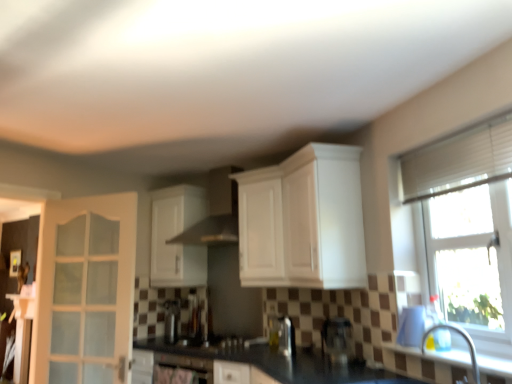
What do you see at coordinates (259, 360) in the screenshot? The height and width of the screenshot is (384, 512). I see `black granite countertop at center` at bounding box center [259, 360].

Where is `transparent glass window at right`? This screenshot has height=384, width=512. transparent glass window at right is located at coordinates (467, 226).

Where is `sleek metallic coffee machine at center, marked as the 2th coffee machine in a front-to-back arrangement`? The image size is (512, 384). sleek metallic coffee machine at center, marked as the 2th coffee machine in a front-to-back arrangement is located at coordinates (282, 334).

The height and width of the screenshot is (384, 512). Describe the element at coordinates (176, 235) in the screenshot. I see `white glossy cabinet at upper center, the 1th cabinetry from the back` at that location.

The height and width of the screenshot is (384, 512). Identify the location of satin silver kettle at center. (170, 320).

What do you see at coordinates (337, 339) in the screenshot? The image size is (512, 384). I see `satin black coffee machine at center, the 2th coffee machine positioned from the left` at bounding box center [337, 339].

Where is `black granite countertop at center`? black granite countertop at center is located at coordinates (259, 360).

Identify the location of faucet in front of the satin silver kettle at center. (463, 337).

Is silver metallic faucet at lower right far away from satin silver kettle at center?

Absolutely, silver metallic faucet at lower right is distant from satin silver kettle at center.

From the image's perspective, is silver metallic faucet at lower right above satin silver kettle at center?

Indeed, from the image's perspective, silver metallic faucet at lower right is shown above satin silver kettle at center.

Does silver metallic faucet at lower right come in front of satin silver kettle at center?

Yes, silver metallic faucet at lower right is closer to the camera.

Identify the location of coffee machine that appears in front of the white glass door at left. (337, 339).

Which of these two, satin black coffee machine at center, the 1th coffee machine in the right-to-left sequence, or white glass door at left, is smaller?

satin black coffee machine at center, the 1th coffee machine in the right-to-left sequence.

Is point (328, 341) closer to viewer compared to point (130, 334)?

Yes, point (328, 341) is closer to viewer.

Considering the sizes of objects satin black coffee machine at center, which appears as the first coffee machine when viewed from the front, and white glass door at left in the image provided, who is wider, satin black coffee machine at center, which appears as the first coffee machine when viewed from the front, or white glass door at left?

satin black coffee machine at center, which appears as the first coffee machine when viewed from the front, is wider.

Does white glossy window sill at lower right turn towards satin black coffee machine at center, the 2th coffee machine positioned from the left?

No, white glossy window sill at lower right does not turn towards satin black coffee machine at center, the 2th coffee machine positioned from the left.

Looking at this image, between white glossy window sill at lower right and satin black coffee machine at center, which appears as the first coffee machine when viewed from the front, which one appears on the right side from the viewer's perspective?

white glossy window sill at lower right.

Looking at this image, in terms of height, does white glossy window sill at lower right look taller or shorter compared to satin black coffee machine at center, the 1th coffee machine in the right-to-left sequence?

white glossy window sill at lower right is shorter than satin black coffee machine at center, the 1th coffee machine in the right-to-left sequence.

Looking at this image, does white glossy window sill at lower right have a lesser width compared to satin black coffee machine at center, which appears as the first coffee machine when viewed from the front?

No, white glossy window sill at lower right is not thinner than satin black coffee machine at center, which appears as the first coffee machine when viewed from the front.

Consider the image. Is satin black coffee machine at center, the second coffee machine from the back, further to camera compared to transparent glass window at right?

Yes, the depth of satin black coffee machine at center, the second coffee machine from the back, is greater than that of transparent glass window at right.

Does satin black coffee machine at center, the second coffee machine from the back, appear on the right side of transparent glass window at right?

No.

Is satin black coffee machine at center, the 2th coffee machine positioned from the left, taller than transparent glass window at right?

Incorrect, the height of satin black coffee machine at center, the 2th coffee machine positioned from the left, is not larger of that of transparent glass window at right.

Identify the location of the 1st coffee machine behind when counting from the transparent glass window at right. The width and height of the screenshot is (512, 384). (337, 339).

Based on the photo, which of these two, white glass door at left or white glossy cabinet at upper center, the second cabinetry in the back-to-front sequence, stands shorter?

white glossy cabinet at upper center, the second cabinetry in the back-to-front sequence.

Is white glass door at left smaller than white glossy cabinet at upper center, the second cabinetry in the back-to-front sequence?

Yes.

Is white glass door at left at the left side of white glossy cabinet at upper center, the second cabinetry in the back-to-front sequence?

Correct, you'll find white glass door at left to the left of white glossy cabinet at upper center, the second cabinetry in the back-to-front sequence.

Is white glass door at left positioned beyond the bounds of white glossy cabinet at upper center, which is the first cabinetry from front to back?

white glass door at left lies outside white glossy cabinet at upper center, which is the first cabinetry from front to back,'s area.

Is sleek metallic coffee machine at center, which is the first coffee machine in back-to-front order, not near white plastic shutter at upper right?

Absolutely, sleek metallic coffee machine at center, which is the first coffee machine in back-to-front order, is distant from white plastic shutter at upper right.

Between sleek metallic coffee machine at center, which is the first coffee machine in back-to-front order, and white plastic shutter at upper right, which one has less height?

Standing shorter between the two is sleek metallic coffee machine at center, which is the first coffee machine in back-to-front order.

Is sleek metallic coffee machine at center, which is the first coffee machine in back-to-front order, aimed at white plastic shutter at upper right?

No.

Considering the sizes of sleek metallic coffee machine at center, the first coffee machine in the left-to-right sequence, and white plastic shutter at upper right in the image, is sleek metallic coffee machine at center, the first coffee machine in the left-to-right sequence, wider or thinner than white plastic shutter at upper right?

sleek metallic coffee machine at center, the first coffee machine in the left-to-right sequence, is wider than white plastic shutter at upper right.

Can you see satin silver kettle at center touching transparent glass window at right?

No, satin silver kettle at center is not next to transparent glass window at right.

Could you tell me if satin silver kettle at center is turned towards transparent glass window at right?

No, satin silver kettle at center is not facing towards transparent glass window at right.

Which object is wider, satin silver kettle at center or transparent glass window at right?

Wider between the two is satin silver kettle at center.

Find the location of a particular element. The height and width of the screenshot is (384, 512). faucet located in front of the satin silver kettle at center is located at coordinates (463, 337).

Where is `door on the left of satin black coffee machine at center, the 1th coffee machine in the right-to-left sequence`? The image size is (512, 384). door on the left of satin black coffee machine at center, the 1th coffee machine in the right-to-left sequence is located at coordinates (85, 291).

Which object lies nearer to the anchor point satin black coffee machine at center, the second coffee machine from the back, sleek metallic coffee machine at center, the first coffee machine in the left-to-right sequence, or satin silver kettle at center?

sleek metallic coffee machine at center, the first coffee machine in the left-to-right sequence, lies closer to satin black coffee machine at center, the second coffee machine from the back, than the other object.

When comparing their distances from white glossy cabinet at upper center, which ranks as the 2th cabinetry in left-to-right order, does transparent glass window at right or white glossy window sill at lower right seem further?

white glossy window sill at lower right lies further to white glossy cabinet at upper center, which ranks as the 2th cabinetry in left-to-right order, than the other object.

When comparing their distances from white glass door at left, does white glossy cabinet at upper center, the 1th cabinetry from the back, or transparent glass window at right seem further?

Among the two, transparent glass window at right is located further to white glass door at left.

From the image, which object appears to be nearer to white plastic shutter at upper right, white glossy window sill at lower right or sleek metallic coffee machine at center, placed as the 2th coffee machine when sorted from right to left?

white glossy window sill at lower right is closer to white plastic shutter at upper right.

From the image, which object appears to be farther from transparent glass window at right, black granite countertop at center or white glossy cabinet at upper center, positioned as the first cabinetry in left-to-right order?

Based on the image, white glossy cabinet at upper center, positioned as the first cabinetry in left-to-right order, appears to be further to transparent glass window at right.

Based on their spatial positions, is white glossy cabinet at upper center, the second cabinetry in the front-to-back sequence, or transparent glass window at right further from white glossy window sill at lower right?

white glossy cabinet at upper center, the second cabinetry in the front-to-back sequence, is further to white glossy window sill at lower right.

Which object lies further to the anchor point satin black coffee machine at center, the 2th coffee machine positioned from the left, white glossy window sill at lower right or white glossy cabinet at upper center, the second cabinetry in the front-to-back sequence?

Based on the image, white glossy cabinet at upper center, the second cabinetry in the front-to-back sequence, appears to be further to satin black coffee machine at center, the 2th coffee machine positioned from the left.

Based on the photo, looking at the image, which one is located further to white glass door at left, white glossy window sill at lower right or satin silver kettle at center?

Among the two, white glossy window sill at lower right is located further to white glass door at left.

Locate an element on the screen. This screenshot has width=512, height=384. window between black granite countertop at center and sleek metallic coffee machine at center, placed as the 2th coffee machine when sorted from right to left, from front to back is located at coordinates (467, 226).

In order to click on window between white plastic shutter at upper right and silver metallic faucet at lower right in the up-down direction in this screenshot , I will do `click(467, 226)`.

Find the location of a particular element. This screenshot has height=384, width=512. shutter located between silver metallic faucet at lower right and sleek metallic coffee machine at center, the first coffee machine in the left-to-right sequence, in the depth direction is located at coordinates (458, 161).

Identify the location of faucet that lies between white plastic shutter at upper right and white glossy window sill at lower right from top to bottom. This screenshot has width=512, height=384. (463, 337).